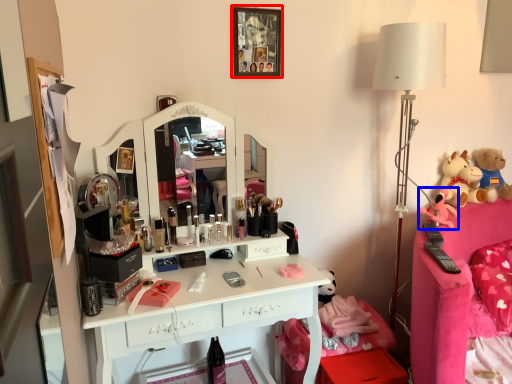
Question: Which point is further to the camera, picture frame (highlighted by a red box) or toy (highlighted by a blue box)?

Choices:
 (A) picture frame
 (B) toy

Answer: (B)